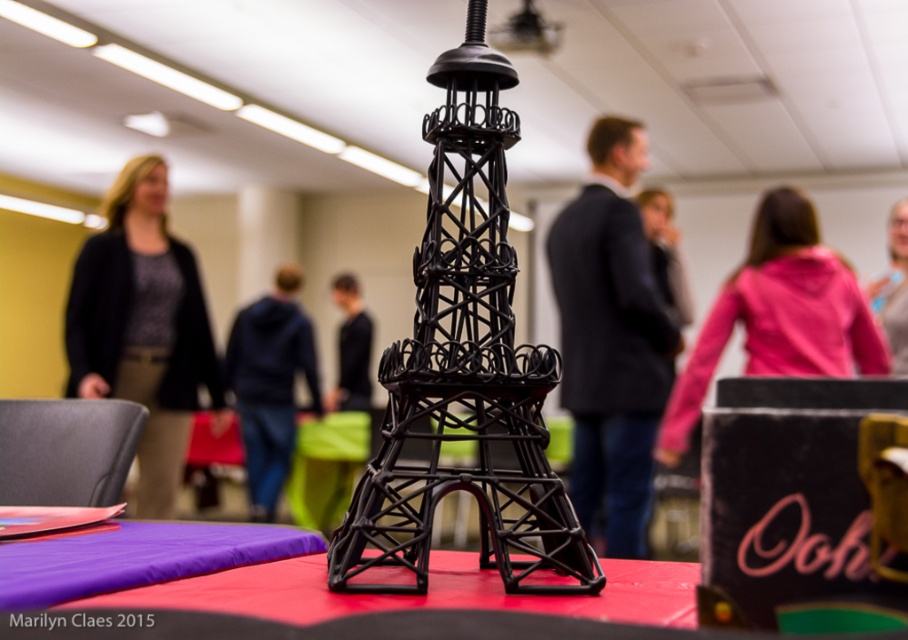
You are a photographer at an event and you want to take a photo of the matte black sweater at left without the camera being visible in the reflection of the black, intricately designed model resembling the Eiffel Tower. Can you position yourself so that the camera is out of the reflection?

The matte black sweater at left and camera are 2.95 meters apart. Since the camera is positioned 2.95 meters away from the sweater, it is likely outside the reflection area of the Eiffel Tower model, allowing the photographer to take the photo without the camera being visible in the reflection.

You are at a social event and see the black Eiffel Tower model on the red tablecloth. Where is the dark suit jacket at center located in relation to the model?

The dark suit jacket at center is located at the coordinates point (610, 339) in 2D space relative to the black Eiffel Tower model on the red tablecloth.

You are at an event and want to take a photo of the black fabric jacket at center without the black matte eiffel tower at center blocking the view. Is this possible?

The black matte eiffel tower at center is closer to the viewer than the black fabric jacket at center, so it will block the view of the jacket. You would need to move around the tower to capture the jacket without obstruction.